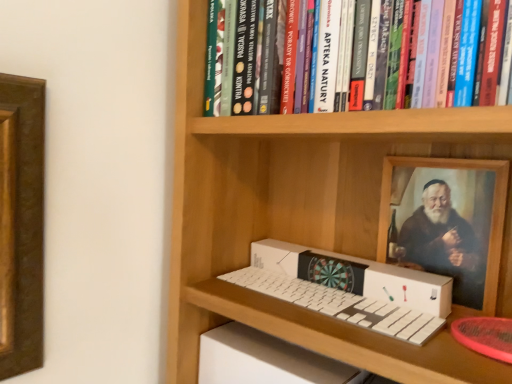
The height and width of the screenshot is (384, 512). In order to click on hardcover book at upper center in this screenshot , I will do `click(446, 53)`.

Consider the image. Measure the distance between hardcover book at upper center and camera.

hardcover book at upper center and camera are 53.46 centimeters apart from each other.

The image size is (512, 384). Describe the element at coordinates (446, 53) in the screenshot. I see `hardcover book at upper center` at that location.

Where is `white cardboard box at center`? The width and height of the screenshot is (512, 384). white cardboard box at center is located at coordinates (356, 275).

What do you see at coordinates (356, 275) in the screenshot? I see `white cardboard box at center` at bounding box center [356, 275].

What is the approximate height of white cardboard box at center?

7.73 centimeters.

The width and height of the screenshot is (512, 384). I want to click on hardcover book at upper center, so click(x=446, y=53).

Considering the positions of objects white cardboard box at center and hardcover book at upper center in the image provided, who is more to the right, white cardboard box at center or hardcover book at upper center?

Positioned to the right is white cardboard box at center.

Which object is further away from the camera, white cardboard box at center or hardcover book at upper center?

Positioned behind is white cardboard box at center.

Is point (387, 298) farther from viewer compared to point (327, 92)?

Yes, it is.

From the image's perspective, is white cardboard box at center over hardcover book at upper center?

Incorrect, from the image's perspective, white cardboard box at center is lower than hardcover book at upper center.

From a real-world perspective, is white cardboard box at center physically above hardcover book at upper center?

No, from a real-world perspective, white cardboard box at center is not on top of hardcover book at upper center.

Considering the relative sizes of white cardboard box at center and hardcover book at upper center in the image provided, is white cardboard box at center wider than hardcover book at upper center?

Incorrect, the width of white cardboard box at center does not surpass that of hardcover book at upper center.

Which of these two, white cardboard box at center or hardcover book at upper center, stands shorter?

white cardboard box at center is shorter.

Which of these two, white cardboard box at center or hardcover book at upper center, is bigger?

Bigger between the two is hardcover book at upper center.

Would you say white cardboard box at center contains hardcover book at upper center?

No, hardcover book at upper center is located outside of white cardboard box at center.

Is white cardboard box at center not near hardcover book at upper center?

No.

Is white cardboard box at center aimed at hardcover book at upper center?

No, white cardboard box at center is not aimed at hardcover book at upper center.

Measure the distance between white cardboard box at center and hardcover book at upper center.

white cardboard box at center is 13.87 inches from hardcover book at upper center.

The height and width of the screenshot is (384, 512). Find the location of `box on the right of hardcover book at upper center`. box on the right of hardcover book at upper center is located at coordinates click(356, 275).

Is hardcover book at upper center to the left of white cardboard box at center from the viewer's perspective?

Indeed, hardcover book at upper center is positioned on the left side of white cardboard box at center.

Does hardcover book at upper center come in front of white cardboard box at center?

Yes.

Which is farther, (x=361, y=38) or (x=284, y=243)?

The point (x=284, y=243) is farther.

From the image's perspective, is hardcover book at upper center on white cardboard box at center?

Yes, from the image's perspective, hardcover book at upper center is over white cardboard box at center.

From a real-world perspective, is hardcover book at upper center located beneath white cardboard box at center?

No, from a real-world perspective, hardcover book at upper center is not beneath white cardboard box at center.

Between hardcover book at upper center and white cardboard box at center, which one has smaller width?

With smaller width is white cardboard box at center.

Does hardcover book at upper center have a lesser height compared to white cardboard box at center?

Incorrect, the height of hardcover book at upper center does not fall short of that of white cardboard box at center.

Looking at this image, between hardcover book at upper center and white cardboard box at center, which one has larger size?

Bigger between the two is hardcover book at upper center.

Would you say hardcover book at upper center contains white cardboard box at center?

Definitely not — white cardboard box at center is not inside hardcover book at upper center.

Is hardcover book at upper center next to white cardboard box at center?

hardcover book at upper center is not next to white cardboard box at center, and they're not touching.

Is hardcover book at upper center oriented away from white cardboard box at center?

No, hardcover book at upper center is not facing away from white cardboard box at center.

How different are the orientations of hardcover book at upper center and white cardboard box at center in degrees?

The angle between the facing direction of hardcover book at upper center and the facing direction of white cardboard box at center is 2.74 degrees.

The height and width of the screenshot is (384, 512). What are the coordinates of `book that appears in front of the white cardboard box at center` in the screenshot? It's located at (446, 53).

Locate an element on the screen. book above the white cardboard box at center (from the image's perspective) is located at coordinates [446, 53].

You are a GUI agent. You are given a task and a screenshot of the screen. Output one action in this format:
    pyautogui.click(x=<x>, y=<y>)
    Task: Click on the box located behind the hardcover book at upper center
    This screenshot has width=512, height=384.
    Given the screenshot: What is the action you would take?
    tap(356, 275)